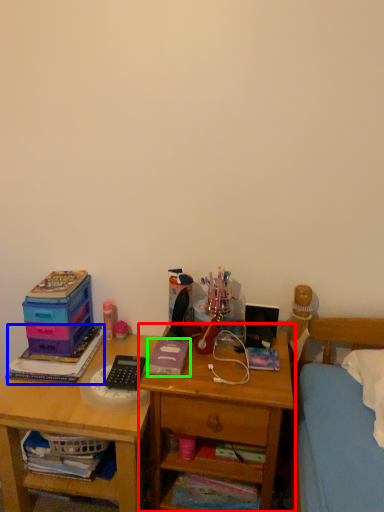
Question: Considering the real-world distances, which object is closest to nightstand (highlighted by a red box)? book (highlighted by a blue box) or book (highlighted by a green box).

Choices:
 (A) book
 (B) book

Answer: (B)